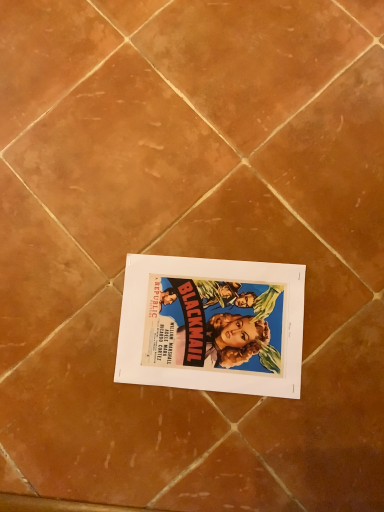
Identify the location of empty space that is ontop of matte paper poster at center (from a real-world perspective). The image size is (384, 512). tap(201, 323).